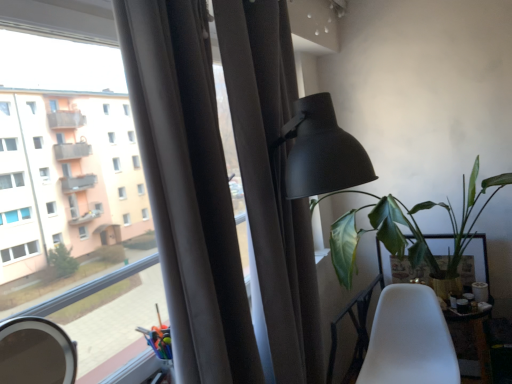
Question: Do you think wooden table at lower right, which is the 2th table from back to front, is within green leafy plant at right, or outside of it?

Choices:
 (A) inside
 (B) outside

Answer: (B)

Question: Based on their sizes in the image, would you say wooden table at lower right, which appears as the 1th table when viewed from the front, is bigger or smaller than green leafy plant at right?

Choices:
 (A) big
 (B) small

Answer: (B)

Question: Estimate the real-world distances between objects in this image. Which object is farther from the green leafy plant at right?

Choices:
 (A) white matte chair at lower right
 (B) matte gray curtain at center
 (C) wooden table at lower right, which is the 2th table from back to front
 (D) matte black mirror at lower left
 (E) white glossy table at lower right, which ranks as the 1th table in back-to-front order

Answer: (D)

Question: Estimate the real-world distances between objects in this image. Which object is farther from the white glossy table at lower right, which ranks as the 1th table in back-to-front order?

Choices:
 (A) matte black mirror at lower left
 (B) matte black lamp at upper right
 (C) green leafy plant at right
 (D) white matte chair at lower right
 (E) wooden table at lower right, which is the 2th table from back to front

Answer: (A)